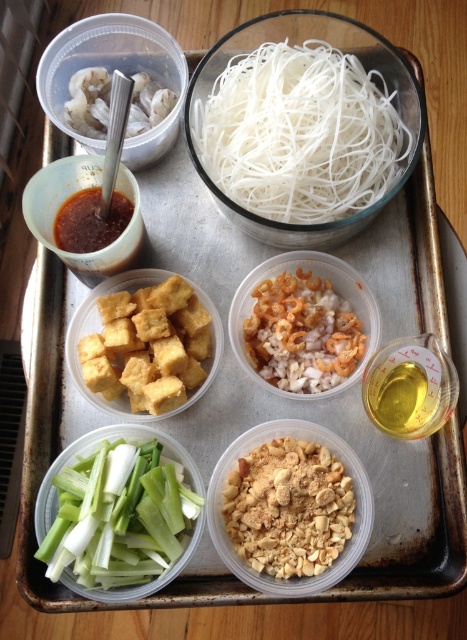
The width and height of the screenshot is (467, 640). Describe the element at coordinates (289, 508) in the screenshot. I see `brown crunchy nuts at center` at that location.

Is brown crunchy nuts at center closer to camera compared to satin brown sauce at upper left?

That is True.

Which is in front, point (255, 525) or point (76, 161)?

Point (255, 525) is in front.

I want to click on brown crunchy nuts at center, so click(x=289, y=508).

Who is positioned more to the left, green crisp at center or smokey brown paste at center left?

From the viewer's perspective, smokey brown paste at center left appears more on the left side.

Which is behind, point (56, 570) or point (93, 227)?

The point (93, 227) is more distant.

At what (x,y) coordinates should I click in order to perform the action: click on green crisp at center. Please return your answer as a coordinate pair (x, y). Image resolution: width=467 pixels, height=640 pixels. Looking at the image, I should click on (120, 513).

Which is more to the left, brown rice with crispy topping at center or satin brown sauce at upper left?

satin brown sauce at upper left

Which of these two, brown rice with crispy topping at center or satin brown sauce at upper left, stands taller?

satin brown sauce at upper left

Does point (317, 360) lie behind point (80, 268)?

Yes, it is.

Image resolution: width=467 pixels, height=640 pixels. What are the coordinates of `brown rice with crispy topping at center` in the screenshot? It's located at (302, 333).